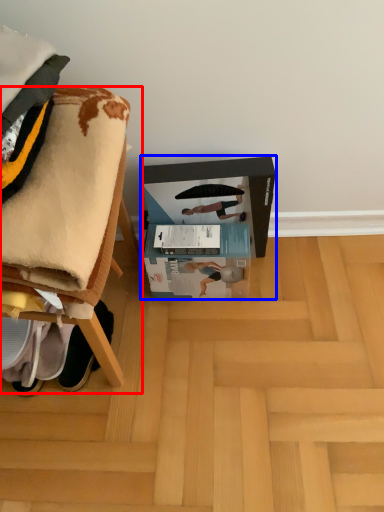
Question: Which object appears farthest to the camera in this image, furniture (highlighted by a red box) or cardboard box (highlighted by a blue box)?

Choices:
 (A) furniture
 (B) cardboard box

Answer: (B)